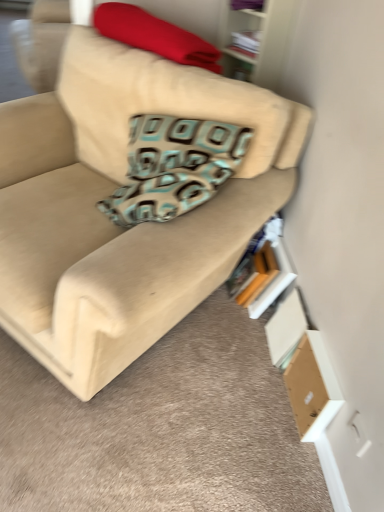
This screenshot has height=512, width=384. I want to click on free space to the left of brown cardboard box at lower right, so click(259, 398).